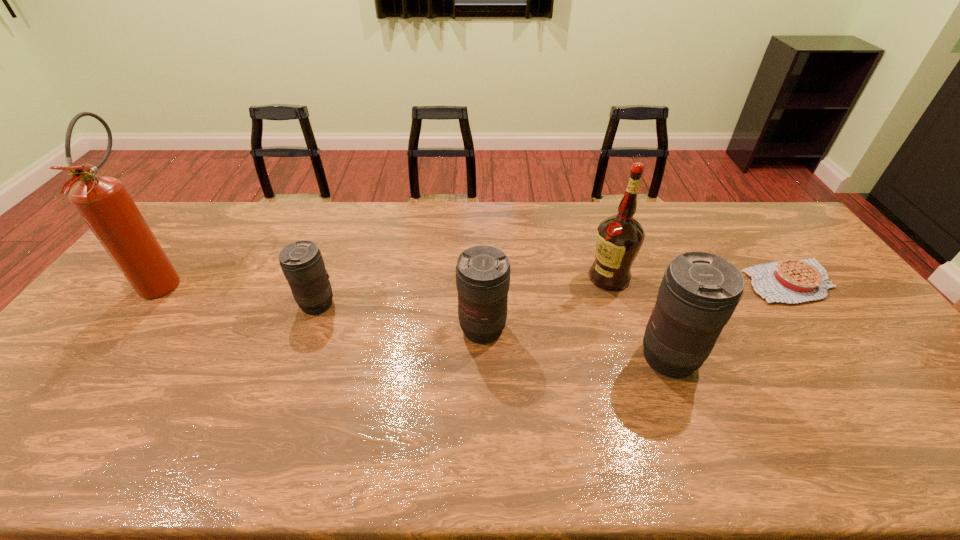
Image resolution: width=960 pixels, height=540 pixels. Find the location of `the leftmost telephoto lens`. the leftmost telephoto lens is located at coordinates (302, 263).

You are a GUI agent. You are given a task and a screenshot of the screen. Output one action in this format:
    pyautogui.click(x=<x>, y=<y>)
    Task: Click on the fifth tallest object
    The height and width of the screenshot is (540, 960).
    Given the screenshot: What is the action you would take?
    pyautogui.click(x=302, y=263)

You are a GUI agent. You are given a task and a screenshot of the screen. Output one action in this format:
    pyautogui.click(x=<x>, y=<y>)
    Task: Click on the second telephoto lens from right to left
    Image resolution: width=960 pixels, height=540 pixels.
    Given the screenshot: What is the action you would take?
    pyautogui.click(x=483, y=272)

The image size is (960, 540). What are the coordinates of `the second tallest telephoto lens` in the screenshot? It's located at (483, 272).

Locate an element on the screen. The image size is (960, 540). the rightmost telephoto lens is located at coordinates click(x=699, y=292).

The image size is (960, 540). I want to click on the third tallest object, so click(x=699, y=292).

At what (x,y) coordinates should I click in order to perform the action: click on the tallest object. Please return your answer as a coordinate pair (x, y). The image size is (960, 540). Looking at the image, I should click on (103, 202).

The image size is (960, 540). I want to click on the leftmost object, so click(x=103, y=202).

The width and height of the screenshot is (960, 540). Identify the location of alcohol. (619, 238).

I want to click on pie, so click(x=787, y=281).